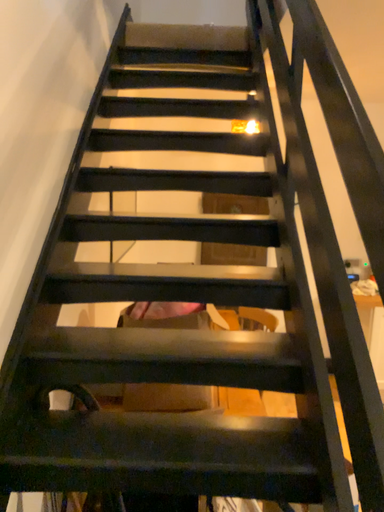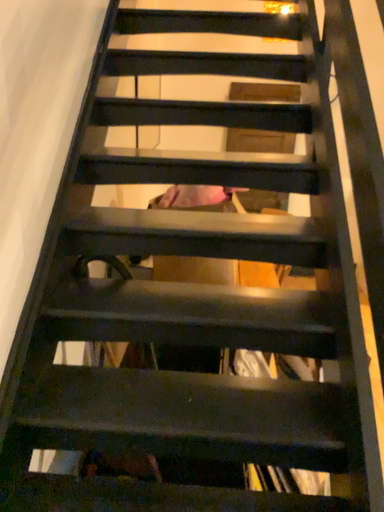
Question: Which way did the camera rotate in the video?

Choices:
 (A) rotated upward
 (B) rotated downward

Answer: (B)